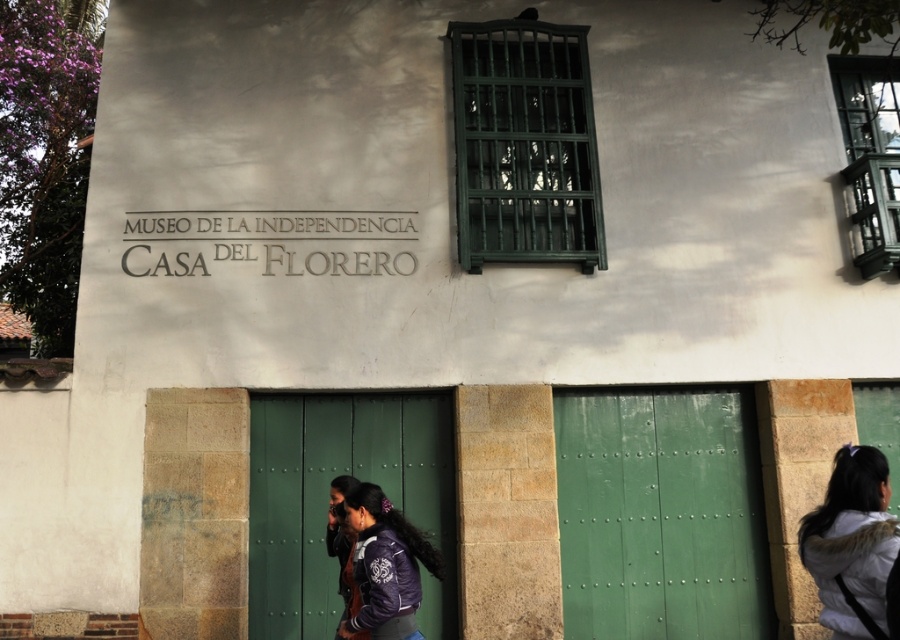
Question: Does white fuzzy jacket at lower right appear under purple matte jacket at center?

Choices:
 (A) no
 (B) yes

Answer: (A)

Question: Is white fuzzy jacket at lower right below purple matte jacket at center?

Choices:
 (A) no
 (B) yes

Answer: (A)

Question: Which object is the closest to the white fuzzy jacket at lower right?

Choices:
 (A) dark purple jacket at center
 (B) purple matte jacket at center

Answer: (B)

Question: Which of the following is the farthest from the observer?

Choices:
 (A) (342, 490)
 (B) (421, 557)

Answer: (A)

Question: Is white fuzzy jacket at lower right smaller than dark purple jacket at center?

Choices:
 (A) no
 (B) yes

Answer: (B)

Question: Which object appears farthest from the camera in this image?

Choices:
 (A) white fuzzy jacket at lower right
 (B) purple matte jacket at center
 (C) dark purple jacket at center

Answer: (C)